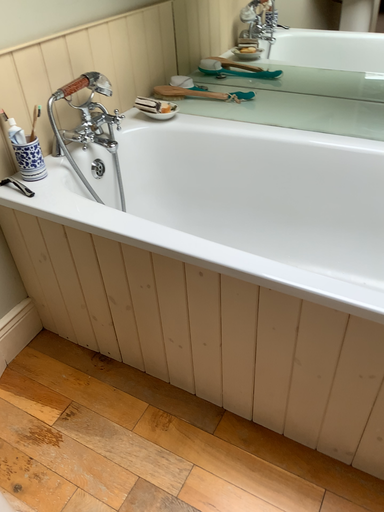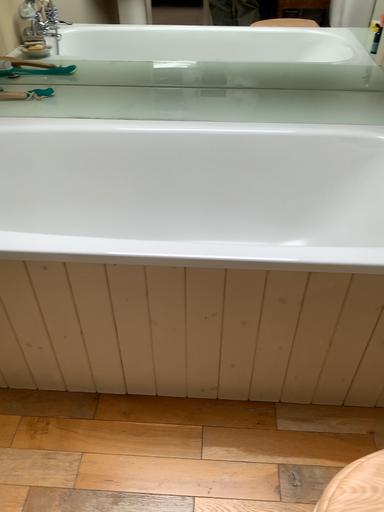
Question: Which way did the camera rotate in the video?

Choices:
 (A) rotated right
 (B) rotated left

Answer: (A)